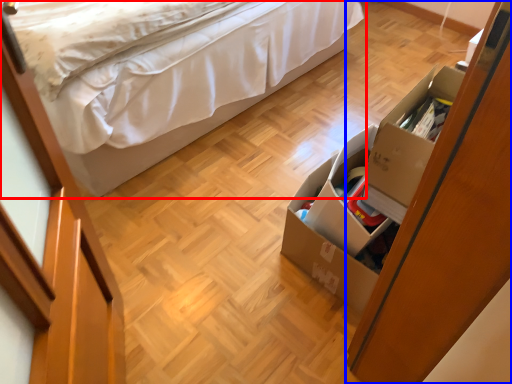
Question: Which object is closer to the camera taking this photo, bed (highlighted by a red box) or dresser (highlighted by a blue box)?

Choices:
 (A) bed
 (B) dresser

Answer: (B)